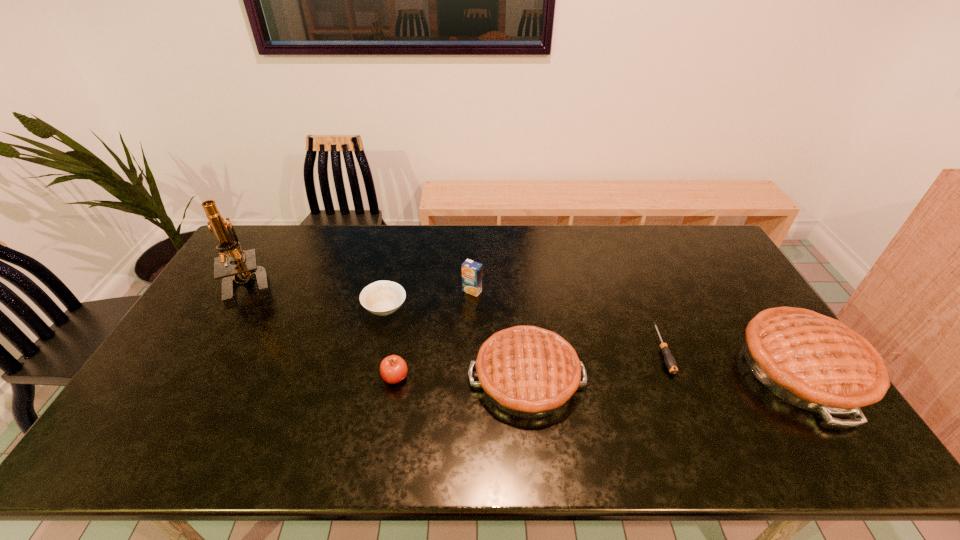
Find the location of a particular element. object located in the far left corner section of the desktop is located at coordinates (245, 267).

This screenshot has width=960, height=540. Identify the location of object that is positioned at the near right corner. (814, 362).

You are a GUI agent. You are given a task and a screenshot of the screen. Output one action in this format:
    pyautogui.click(x=<x>, y=<y>)
    Task: Click on the vacant space at the far edge of the desktop
    This screenshot has height=540, width=960.
    Given the screenshot: What is the action you would take?
    pyautogui.click(x=314, y=253)

You are a GUI agent. You are given a task and a screenshot of the screen. Output one action in this format:
    pyautogui.click(x=<x>, y=<y>)
    Task: Click on the vacant space at the near edge of the desktop
    
    Given the screenshot: What is the action you would take?
    pyautogui.click(x=418, y=409)

The image size is (960, 540). What are the coordinates of `vacant space at the left edge of the desktop` in the screenshot? It's located at (252, 306).

Image resolution: width=960 pixels, height=540 pixels. In the image, there is a desktop. In order to click on vacant space at the right edge in this screenshot , I will do [726, 292].

In the image, there is a desktop. Find the location of `vacant region at the far left corner`. vacant region at the far left corner is located at coordinates (253, 230).

The width and height of the screenshot is (960, 540). What are the coordinates of `vacant space at the far right corner of the desktop` in the screenshot? It's located at (709, 240).

You are a GUI agent. You are given a task and a screenshot of the screen. Output one action in this format:
    pyautogui.click(x=<x>, y=<y>)
    Task: Click on the free space between the left pie and the taller pie
    The width and height of the screenshot is (960, 540).
    Given the screenshot: What is the action you would take?
    tap(664, 374)

Where is `free space that is in between the microscope and the orange_juice`? The image size is (960, 540). free space that is in between the microscope and the orange_juice is located at coordinates (361, 287).